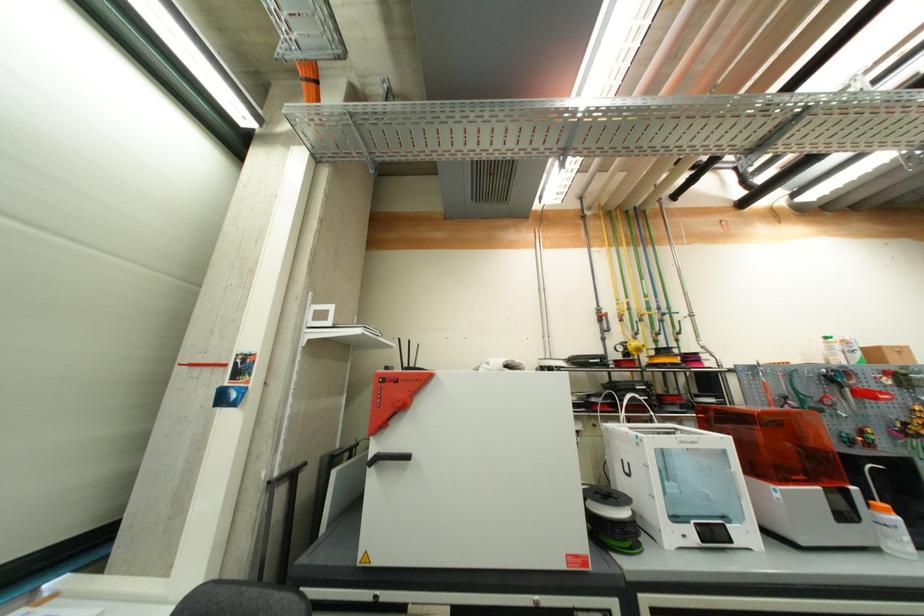
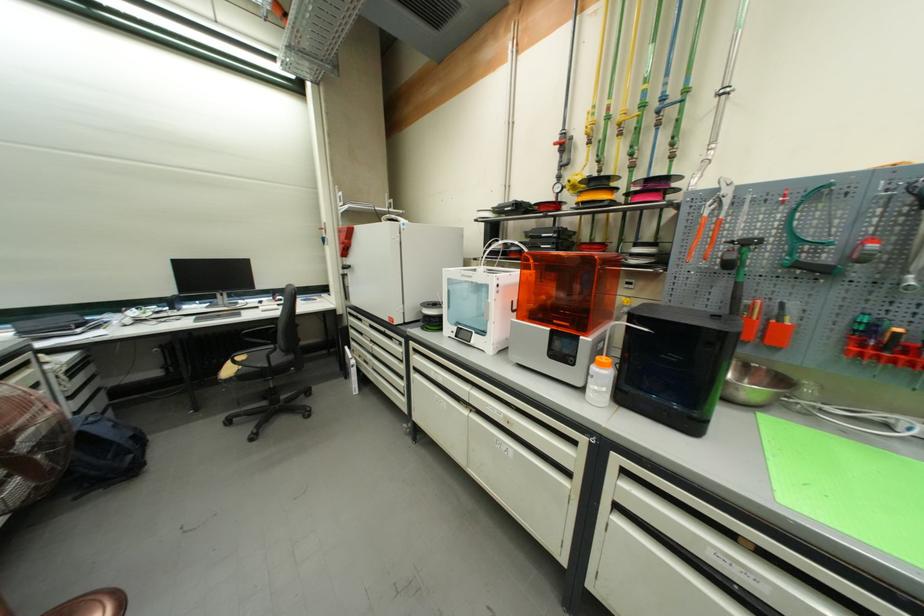
Find the pixel in the second image that matches point (799, 480) in the first image.

(561, 323)